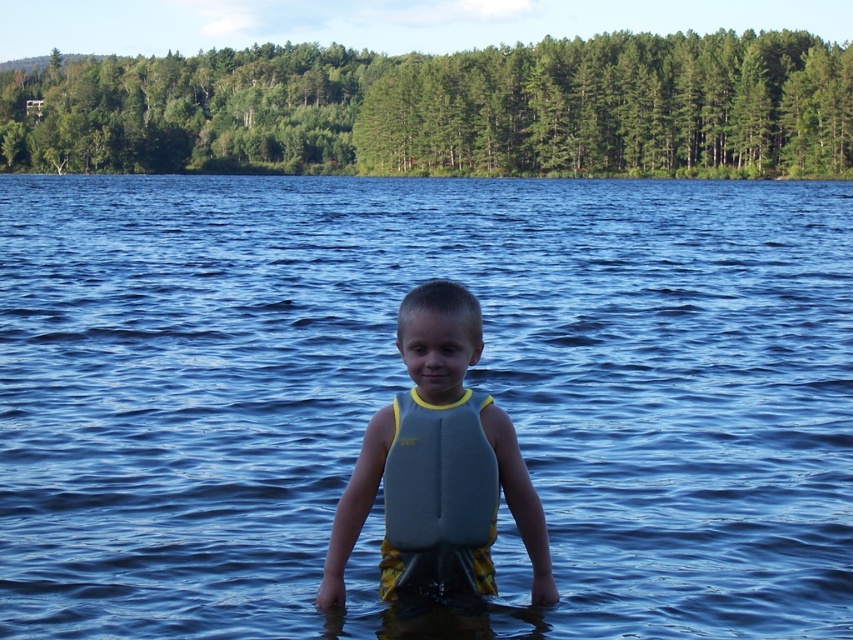
You are a drone operator trying to capture the best aerial shot of the blue water at center. Based on the coordinates provided, where should you position the drone to focus the camera?

The blue water at center is located at point (409, 384), so the drone should position its camera focus at those coordinates to capture the blue water at center effectively.